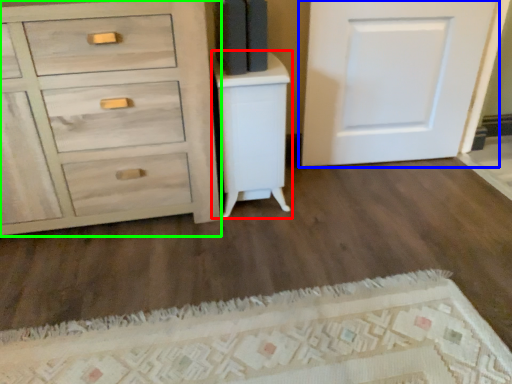
Question: Which is nearer to the vanity (highlighted by a red box)? door (highlighted by a blue box) or chest of drawers (highlighted by a green box).

Choices:
 (A) door
 (B) chest of drawers

Answer: (B)